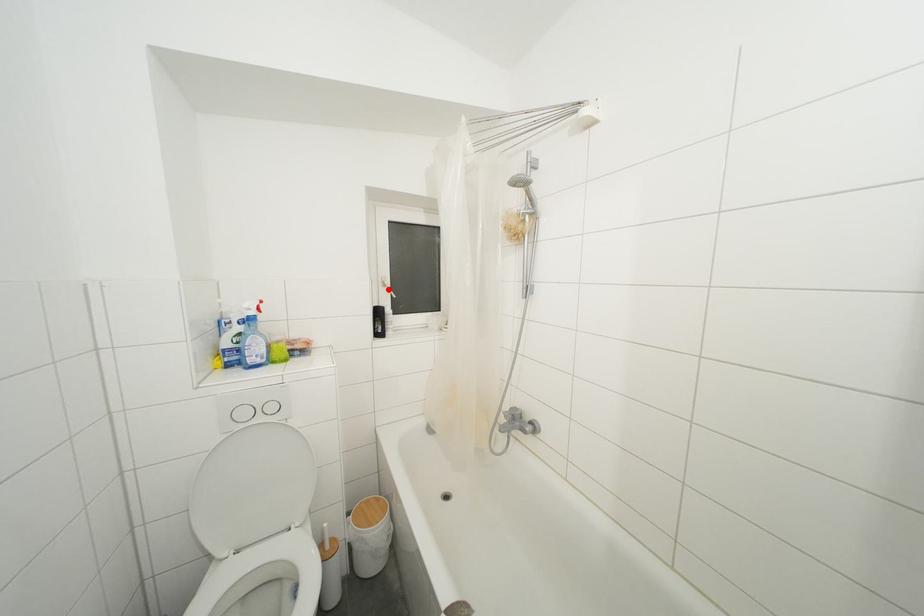
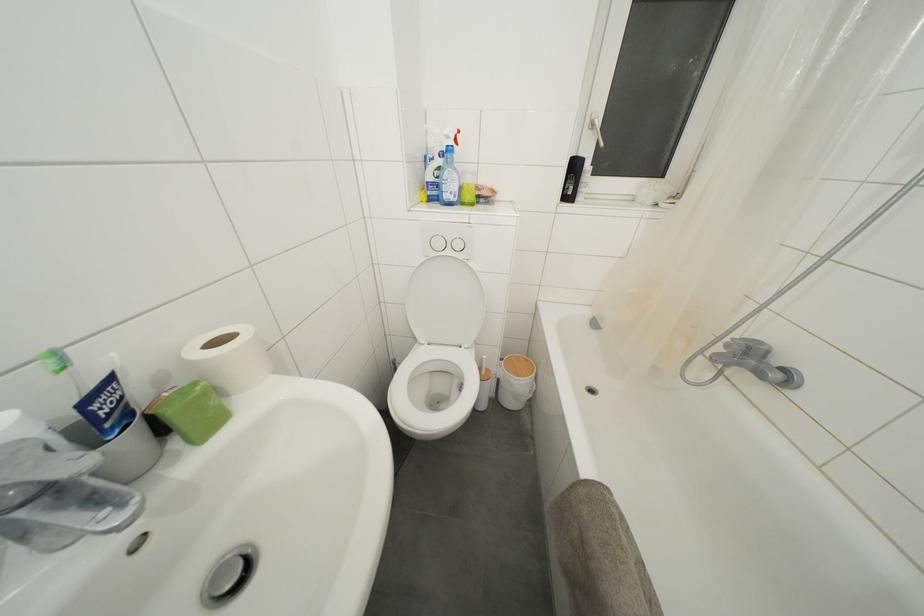
In the second image, find the point that corresponds to the highlighted location in the first image.

(597, 131)